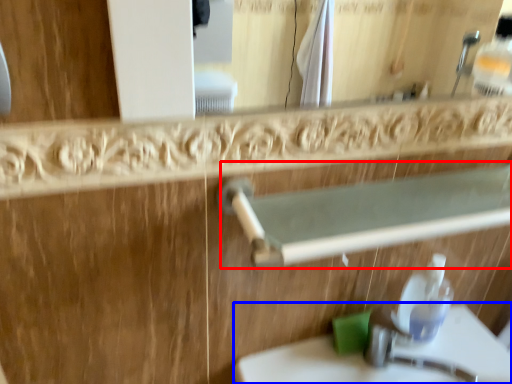
Question: Which of the following is the closest to the observer, balustrade (highlighted by a red box) or sink (highlighted by a blue box)?

Choices:
 (A) balustrade
 (B) sink

Answer: (A)